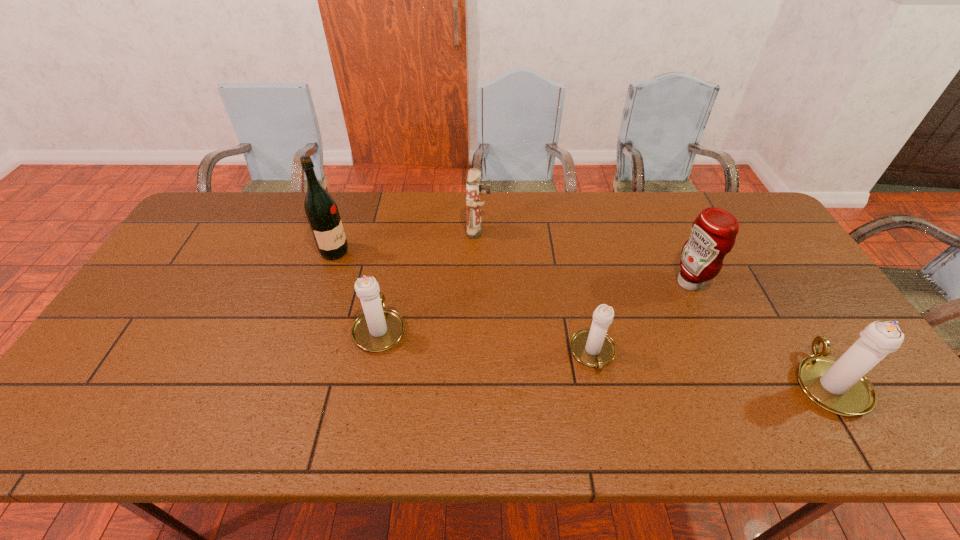
Identify the location of free point that keeps the candle holders evenly spaced on the left. This screenshot has width=960, height=540. (186, 305).